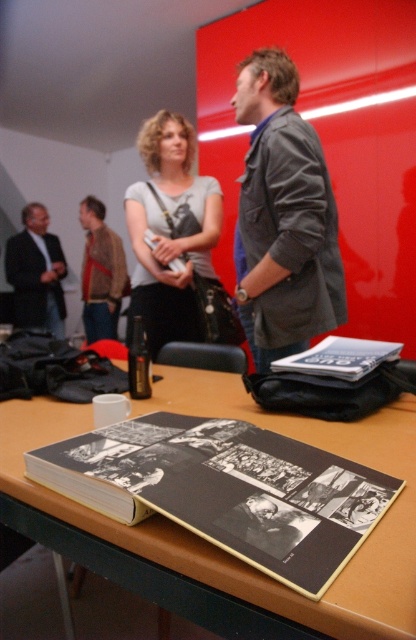
Measure the distance from matte black suit at left to brown leather jacket at left.

matte black suit at left and brown leather jacket at left are 15.85 inches apart.

Is matte black suit at left positioned in front of brown leather jacket at left?

No.

Between point (64, 298) and point (114, 248), which one is positioned in front?

Point (114, 248) is in front.

The width and height of the screenshot is (416, 640). I want to click on matte black suit at left, so click(37, 273).

Does brown leather jacket at left appear over black matte book at center?

Yes.

Which is more to the left, brown leather jacket at left or black matte book at center?

brown leather jacket at left is more to the left.

Locate an element on the screen. The width and height of the screenshot is (416, 640). brown leather jacket at left is located at coordinates (101, 273).

Image resolution: width=416 pixels, height=640 pixels. In order to click on brown leather jacket at left in this screenshot , I will do `click(101, 273)`.

Looking at this image, who is more distant from viewer, (151, 257) or (49, 292)?

Point (49, 292)

Is point (163, 150) closer to viewer compared to point (32, 212)?

That is True.

Find the location of `matte gray shirt at center`. matte gray shirt at center is located at coordinates (x=170, y=230).